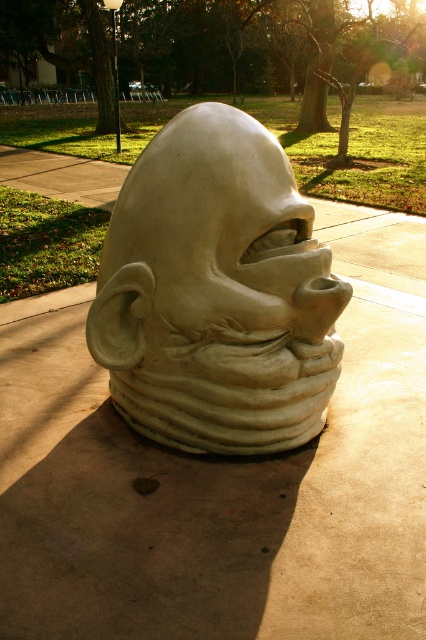
From the picture: Can you confirm if white matte sculpture at center is wider than matte clay face at center?

Yes, white matte sculpture at center is wider than matte clay face at center.

Is point (207, 198) in front of point (288, 364)?

Yes, point (207, 198) is closer to viewer.

Does point (167, 289) lie in front of point (242, 145)?

No, (167, 289) is further to viewer.

I want to click on white matte sculpture at center, so click(216, 292).